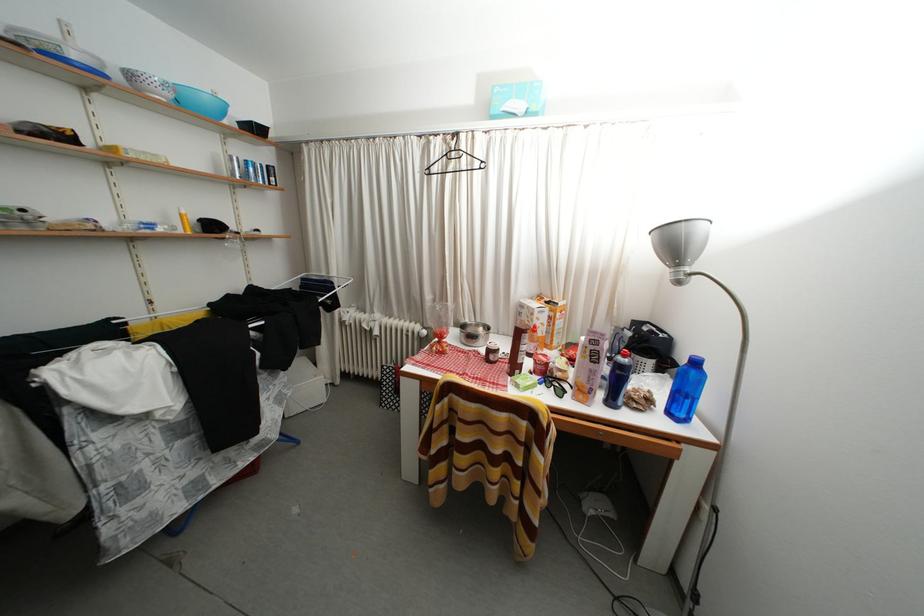
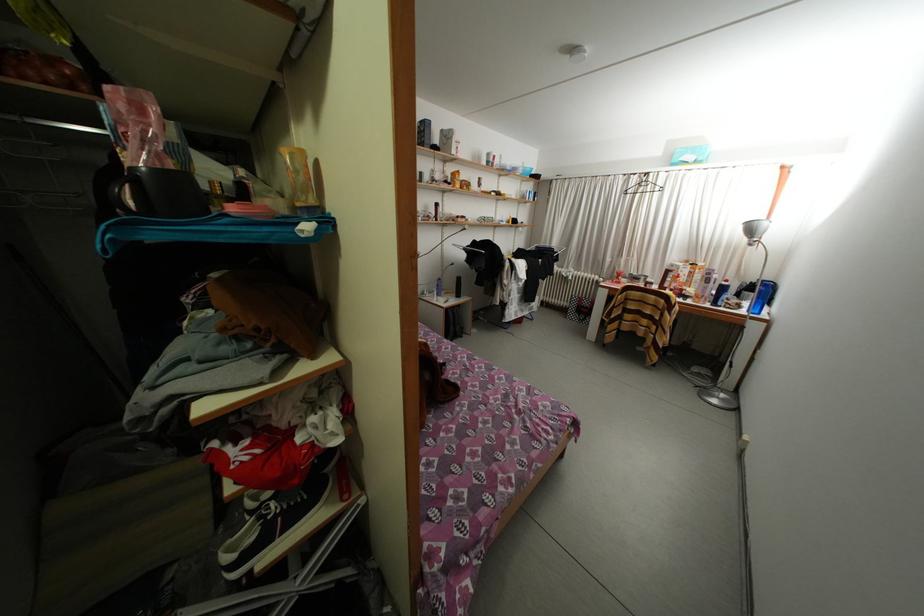
Find the pixel in the second image that matches pixel 436 148 in the first image.

(638, 184)